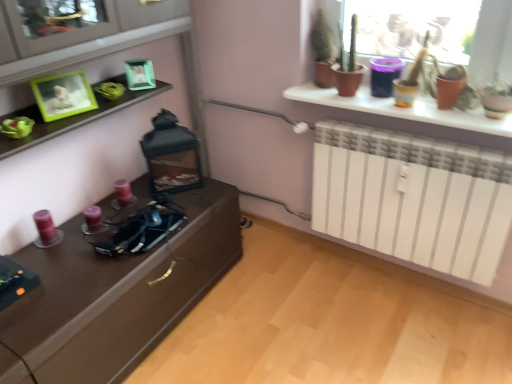
Question: In which direction should I rotate to look at green matte picture frame at upper center, which appears as the 1th picture frame when viewed from the right?

Choices:
 (A) right
 (B) left

Answer: (B)

Question: Is green matte picture frame at upper center, the 1th picture frame from the back, completely or partially outside of green matte picture frame at upper left, acting as the second picture frame starting from the back?

Choices:
 (A) yes
 (B) no

Answer: (A)

Question: From the image's perspective, does green matte picture frame at upper center, which appears as the 1th picture frame when viewed from the right, appear lower than green matte picture frame at upper left, which appears as the 2th picture frame when viewed from the right?

Choices:
 (A) no
 (B) yes

Answer: (A)

Question: Does green matte picture frame at upper center, placed as the second picture frame when sorted from front to back, have a greater height compared to green matte picture frame at upper left, the 1th picture frame viewed from the left?

Choices:
 (A) no
 (B) yes

Answer: (A)

Question: Is green matte picture frame at upper center, the 1th picture frame from the back, smaller than green matte picture frame at upper left, the 1th picture frame viewed from the left?

Choices:
 (A) yes
 (B) no

Answer: (A)

Question: Does green matte picture frame at upper center, which appears as the 1th picture frame when viewed from the right, appear on the left side of green matte picture frame at upper left, the 1th picture frame viewed from the left?

Choices:
 (A) no
 (B) yes

Answer: (A)

Question: From a real-world perspective, is green matte picture frame at upper center, positioned as the 2th picture frame in left-to-right order, under green matte picture frame at upper left, placed as the first picture frame when sorted from front to back?

Choices:
 (A) no
 (B) yes

Answer: (B)

Question: Does green matte picture frame at upper left, placed as the first picture frame when sorted from front to back, have a lesser height compared to green matte picture frame at upper center, placed as the second picture frame when sorted from front to back?

Choices:
 (A) yes
 (B) no

Answer: (B)

Question: Considering the relative positions of green matte picture frame at upper left, placed as the first picture frame when sorted from front to back, and green matte picture frame at upper center, placed as the second picture frame when sorted from front to back, in the image provided, is green matte picture frame at upper left, placed as the first picture frame when sorted from front to back, behind green matte picture frame at upper center, placed as the second picture frame when sorted from front to back,?

Choices:
 (A) no
 (B) yes

Answer: (A)

Question: Is green matte picture frame at upper left, the 1th picture frame viewed from the left, bigger than green matte picture frame at upper center, which appears as the 1th picture frame when viewed from the right?

Choices:
 (A) no
 (B) yes

Answer: (B)

Question: Is green matte picture frame at upper center, placed as the second picture frame when sorted from front to back, completely or partially inside green matte picture frame at upper left, placed as the first picture frame when sorted from front to back?

Choices:
 (A) no
 (B) yes

Answer: (A)

Question: From the image's perspective, is green matte picture frame at upper left, placed as the first picture frame when sorted from front to back, under green matte picture frame at upper center, which appears as the 1th picture frame when viewed from the right?

Choices:
 (A) no
 (B) yes

Answer: (B)

Question: Is green matte picture frame at upper left, acting as the second picture frame starting from the back, positioned before green matte picture frame at upper center, positioned as the 2th picture frame in left-to-right order?

Choices:
 (A) yes
 (B) no

Answer: (A)

Question: Looking at their shapes, would you say green matte picture frame at upper center, placed as the second picture frame when sorted from front to back, is wider or thinner than green matte picture frame at upper left, the 1th picture frame viewed from the left?

Choices:
 (A) thin
 (B) wide

Answer: (A)